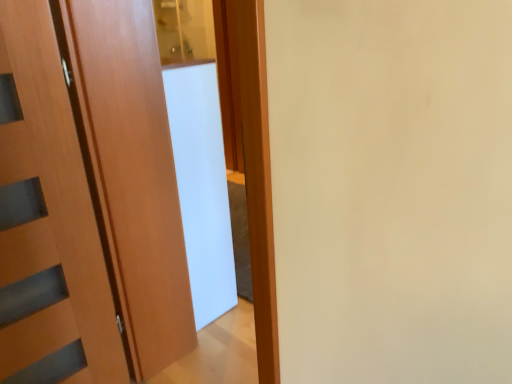
Question: From the image's perspective, relative to wooden door at left, is white glossy screen door at center above or below?

Choices:
 (A) above
 (B) below

Answer: (A)

Question: Relative to wooden door at left, is white glossy screen door at center in front or behind?

Choices:
 (A) front
 (B) behind

Answer: (B)

Question: Does point (183, 195) appear closer or farther from the camera than point (53, 279)?

Choices:
 (A) closer
 (B) farther

Answer: (B)

Question: Is wooden door at left situated inside white glossy screen door at center or outside?

Choices:
 (A) inside
 (B) outside

Answer: (B)

Question: From a real-world perspective, is wooden door at left positioned above or below white glossy screen door at center?

Choices:
 (A) above
 (B) below

Answer: (A)

Question: Considering the relative positions of wooden door at left and white glossy screen door at center in the image provided, is wooden door at left to the left or to the right of white glossy screen door at center?

Choices:
 (A) left
 (B) right

Answer: (A)

Question: Is point (51, 357) closer or farther from the camera than point (220, 173)?

Choices:
 (A) closer
 (B) farther

Answer: (A)